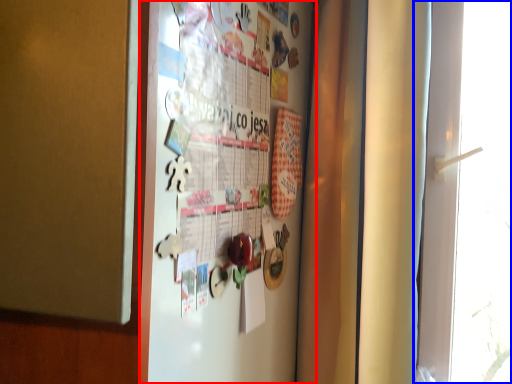
Question: Which object is further to the camera taking this photo, fridge (highlighted by a red box) or window (highlighted by a blue box)?

Choices:
 (A) fridge
 (B) window

Answer: (B)